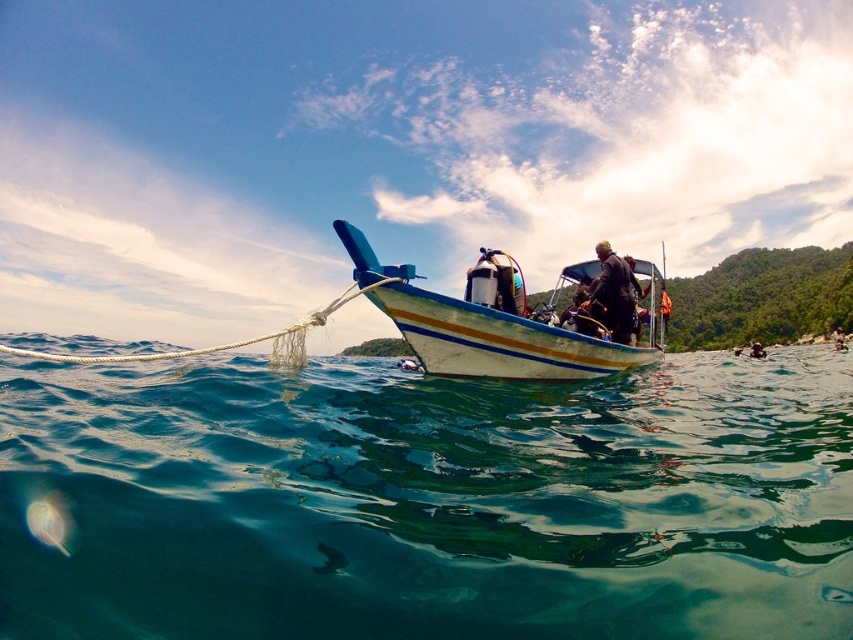
Question: Is dark brown leather jacket at center to the left of translucent gelatinous at lower left from the viewer's perspective?

Choices:
 (A) yes
 (B) no

Answer: (B)

Question: Estimate the real-world distances between objects in this image. Which object is farther from the translucent gelatinous at lower left?

Choices:
 (A) transparent blue water at center
 (B) wooden boat at center
 (C) dark brown leather jacket at center

Answer: (C)

Question: In this image, where is dark brown leather jacket at center located relative to translucent gelatinous at lower left?

Choices:
 (A) above
 (B) below

Answer: (A)

Question: Which of the following is the closest to the observer?

Choices:
 (A) (610, 288)
 (B) (32, 525)
 (C) (339, 376)

Answer: (B)

Question: Can you confirm if transparent blue water at center is positioned below dark brown leather jacket at center?

Choices:
 (A) yes
 (B) no

Answer: (A)

Question: Which is nearer to the translucent gelatinous at lower left?

Choices:
 (A) dark brown leather jacket at center
 (B) transparent blue water at center

Answer: (B)